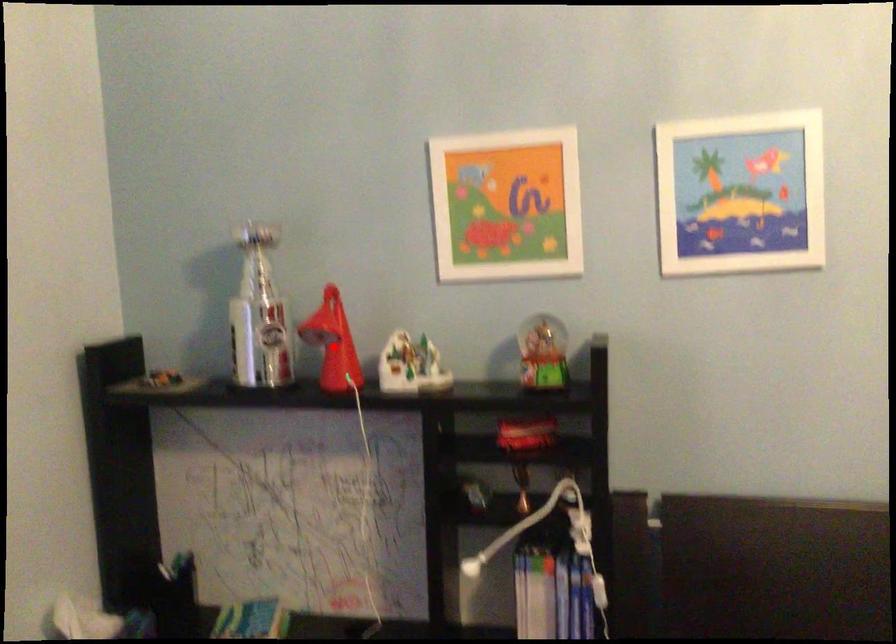
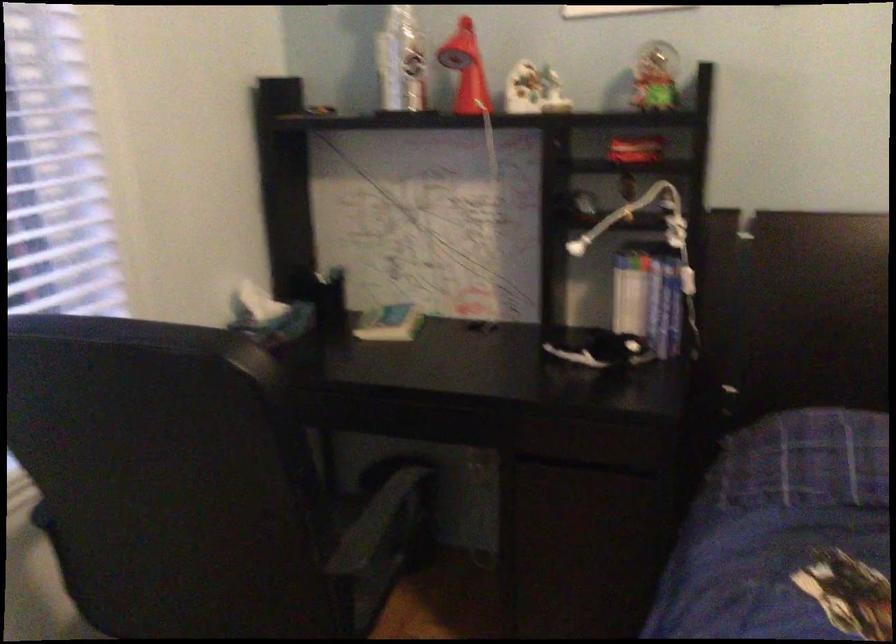
Question: I am providing you with two images of the same scene from different viewpoints. Image1 has a red point marked. In image2, the corresponding 3D location appears at what relative position? Reply with the corresponding letter.

Choices:
 (A) Closer
 (B) Farther

Answer: (B)